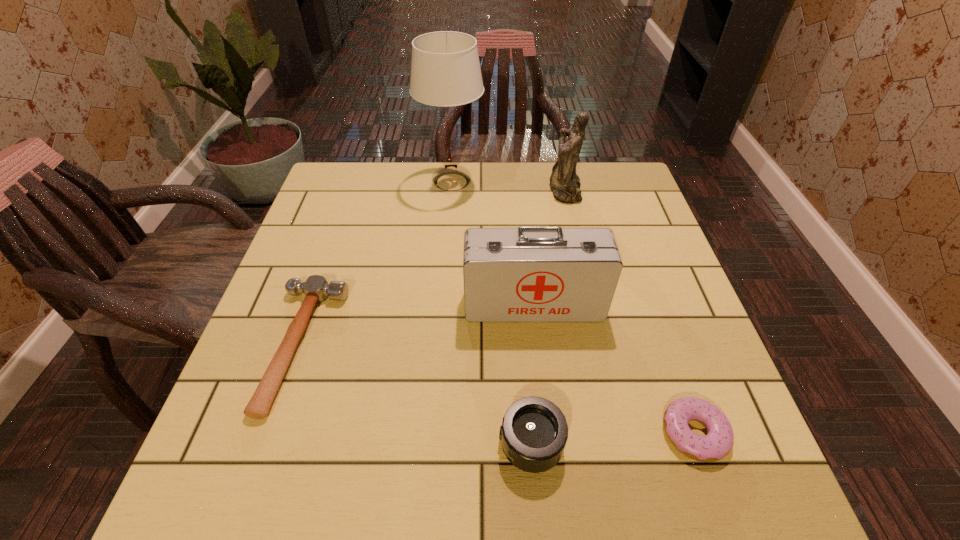
At what (x,y) coordinates should I click in order to perform the action: click on vacant space at the far right corner of the desktop. Please return your answer as a coordinate pair (x, y). The height and width of the screenshot is (540, 960). Looking at the image, I should click on (594, 177).

Find the location of `free point between the second tallest object and the table lamp`. free point between the second tallest object and the table lamp is located at coordinates (508, 186).

Where is `free spot between the tallest object and the fifth tallest object`? The width and height of the screenshot is (960, 540). free spot between the tallest object and the fifth tallest object is located at coordinates (377, 264).

At what (x,y) coordinates should I click in order to perform the action: click on vacant region between the fourth shortest object and the doughnut. Please return your answer as a coordinate pair (x, y). Image resolution: width=960 pixels, height=540 pixels. Looking at the image, I should click on (614, 369).

Where is `vacant region between the doughnut and the third tallest object`? This screenshot has height=540, width=960. vacant region between the doughnut and the third tallest object is located at coordinates point(614,369).

Identify the location of empty location between the first-aid kit and the hammer. (418, 325).

At what (x,y) coordinates should I click in order to perform the action: click on free spot between the fourth shortest object and the doughnut. Please return your answer as a coordinate pair (x, y). Looking at the image, I should click on (614, 369).

The height and width of the screenshot is (540, 960). Identify the location of empty space between the fourth tallest object and the rightmost object. (612, 438).

Find the location of `object that stands as the third closest to the third shortest object`. object that stands as the third closest to the third shortest object is located at coordinates (316, 288).

Locate an element on the screen. Image resolution: width=960 pixels, height=540 pixels. object that is the fifth closest to the figurine is located at coordinates 534,431.